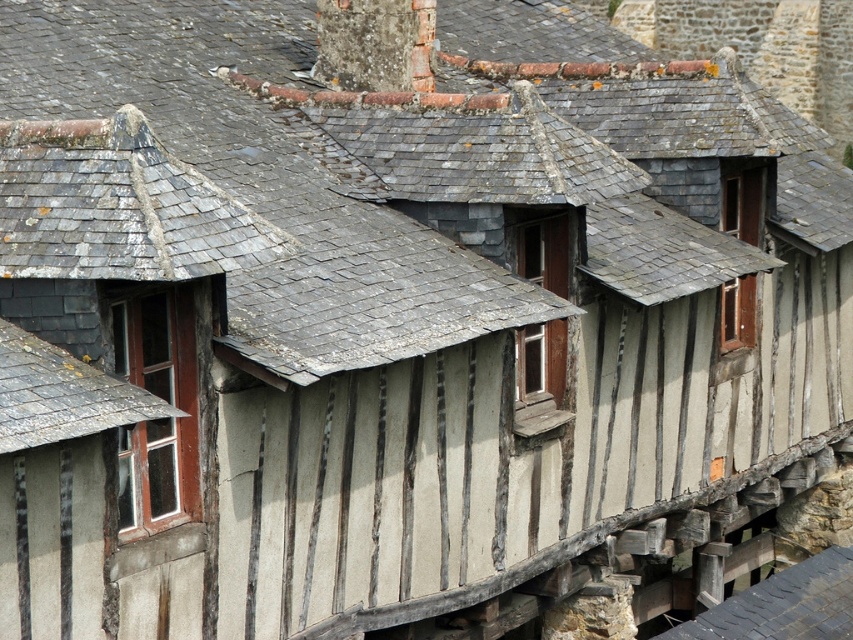
Does point (143, 435) come closer to viewer compared to point (532, 256)?

Yes.

Where is `wooden-framed window at left`? wooden-framed window at left is located at coordinates (160, 419).

Who is more distant from viewer, (x=190, y=500) or (x=106, y=381)?

The point (x=190, y=500) is more distant.

I want to click on wooden-framed window at left, so click(160, 419).

How distant is wooden-framed window at left from wooden window at center-right?

wooden-framed window at left is 71.02 feet from wooden window at center-right.

Between wooden-framed window at left and wooden window at center-right, which one is positioned higher?

wooden window at center-right is above.

Which is in front, point (131, 483) or point (727, 188)?

Point (131, 483) is more forward.

Where is `wooden-framed window at left`? The width and height of the screenshot is (853, 640). wooden-framed window at left is located at coordinates (160, 419).